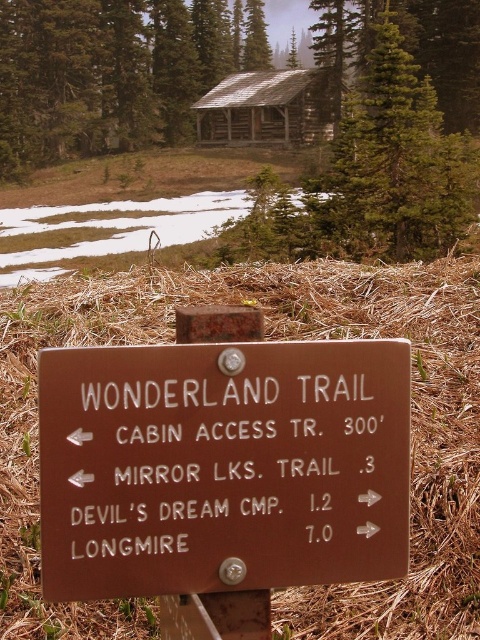
You are standing in front of the brown wooden sign at center and want to know if it is bigger than the wooden cabin at upper center. What should you observe?

The brown wooden sign at center is smaller than the wooden cabin at upper center, so the sign is not bigger than the cabin.